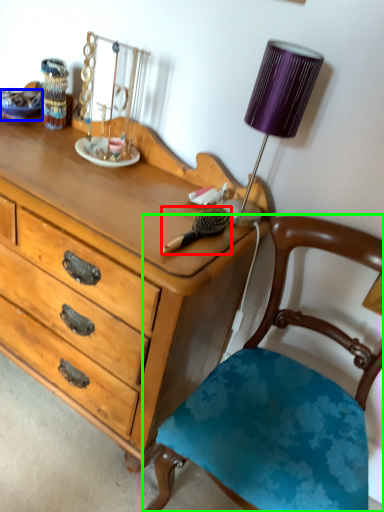
Question: Which object is positioned closest to brush (highlighted by a red box)? Select from plate (highlighted by a blue box) and chair (highlighted by a green box).

Choices:
 (A) plate
 (B) chair

Answer: (B)